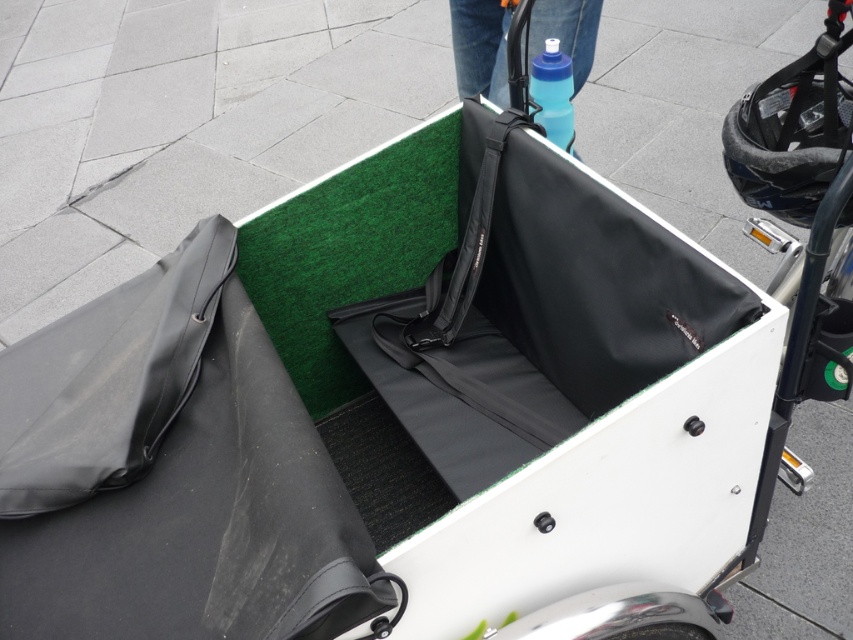
In the scene shown: You are loading items into the cargo bike trailer and notice the black fabric strap at center and the metallic silver wheel at lower center. Which object is positioned to the left when viewed from the front of the trailer?

The black fabric strap at center is to the left of the metallic silver wheel at lower center.

You are a delivery person checking the cargo bike trailer. You need to locate the blue matte water bottle at upper center and the metallic silver wheel at lower center. According to the scene, which object is positioned to the left of the other?

The blue matte water bottle at upper center is to the left of metallic silver wheel at lower center.

Looking at this image, you are organizing items in the cargo bike trailer and notice the blue matte water bottle at upper center and the black fabric strap at center. Which item is positioned to the right side of the other?

The blue matte water bottle at upper center is to the right of the black fabric strap at center.